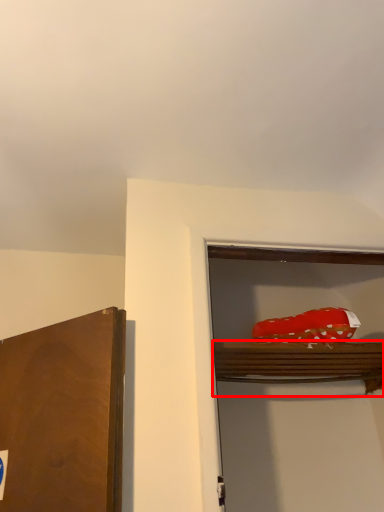
Question: Observing the image, what is the correct spatial positioning of shelf (annotated by the red box) in reference to food?

Choices:
 (A) left
 (B) right

Answer: (B)